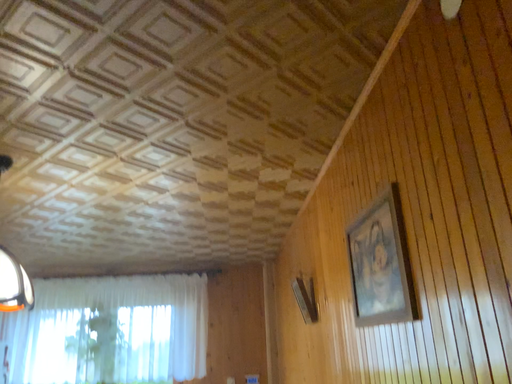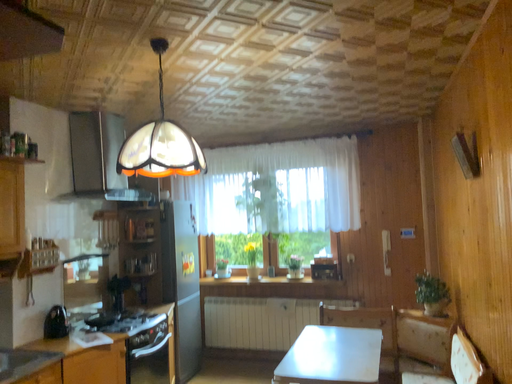
Question: Which way did the camera rotate in the video?

Choices:
 (A) rotated right
 (B) rotated left

Answer: (B)